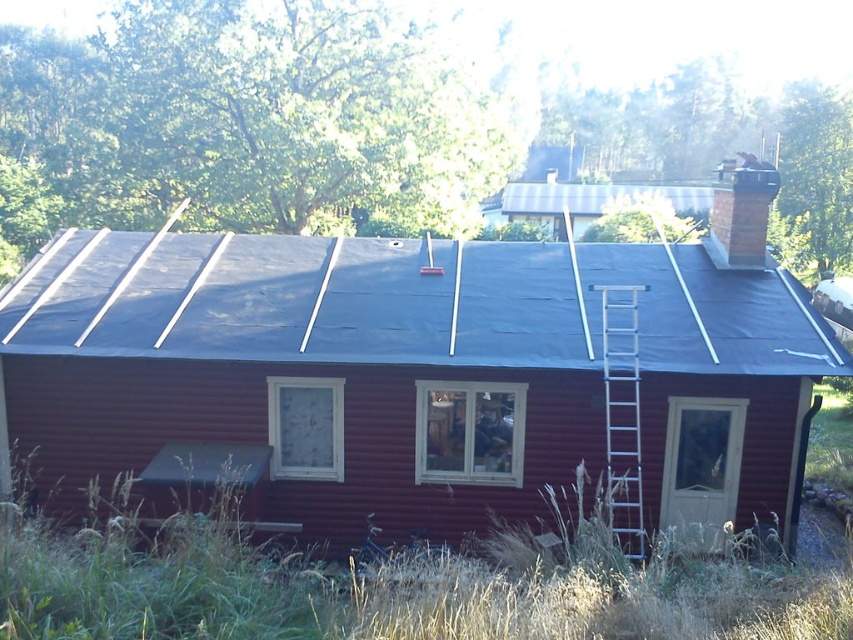
Does smooth dark blue tarp at center appear on the right side of black tarp at center?

Correct, you'll find smooth dark blue tarp at center to the right of black tarp at center.

Who is more distant from viewer, (648, 272) or (643, 253)?

The point (643, 253) is behind.

Between point (779, 314) and point (83, 250), which one is positioned behind?

Point (83, 250)

The height and width of the screenshot is (640, 853). Find the location of `smooth dark blue tarp at center`. smooth dark blue tarp at center is located at coordinates (413, 371).

Which of these two, black tarp at center or silver metallic ladder at right, stands taller?

silver metallic ladder at right

Who is positioned more to the right, black tarp at center or silver metallic ladder at right?

silver metallic ladder at right

Identify the location of black tarp at center. (405, 304).

Locate an element on the screen. black tarp at center is located at coordinates (405, 304).

Does smooth dark blue tarp at center appear under silver metallic ladder at right?

Actually, smooth dark blue tarp at center is above silver metallic ladder at right.

Can you confirm if smooth dark blue tarp at center is positioned above silver metallic ladder at right?

Yes.

Where is `smooth dark blue tarp at center`? This screenshot has height=640, width=853. smooth dark blue tarp at center is located at coordinates (413, 371).